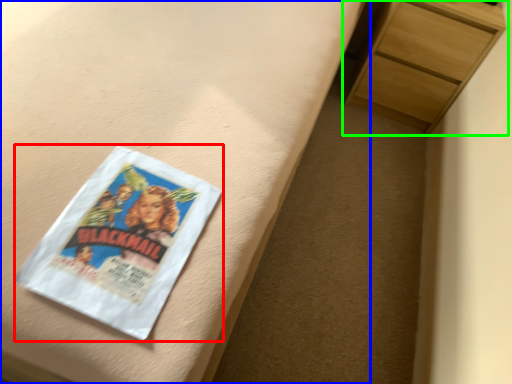
Question: Estimate the real-world distances between objects in this image. Which object is farther from paperback book (highlighted by a red box), bed frame (highlighted by a blue box) or chest of drawers (highlighted by a green box)?

Choices:
 (A) bed frame
 (B) chest of drawers

Answer: (B)